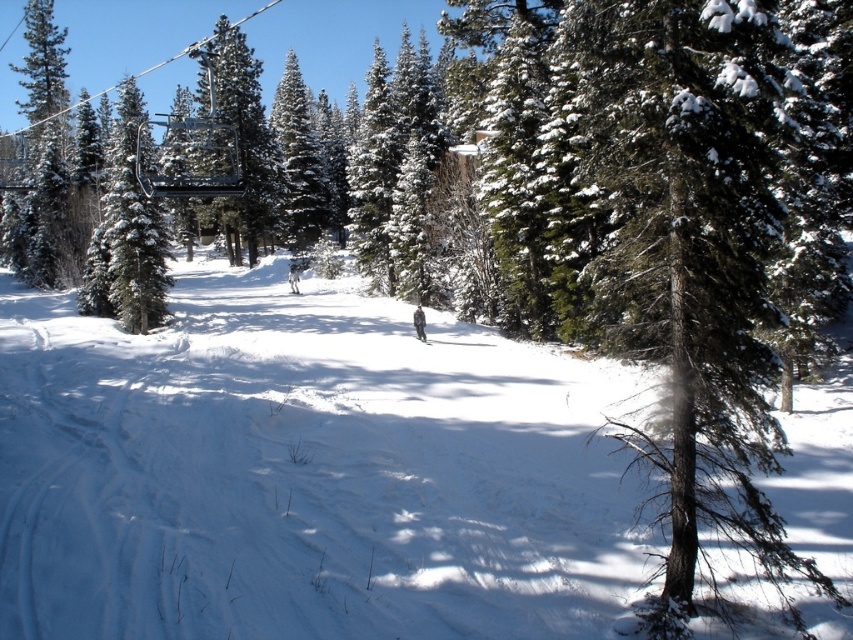
Question: Which object is the closest to the green matte evergreen tree at center?

Choices:
 (A) white plastic ski at center
 (B) white matte ski at center
 (C) white snow at center

Answer: (B)

Question: Can you confirm if white snow at center is wider than white matte ski at center?

Choices:
 (A) yes
 (B) no

Answer: (A)

Question: Which object is the closest to the white plastic ski at center?

Choices:
 (A) white matte ski at center
 (B) white snow at center

Answer: (B)

Question: Is white snow at center further to camera compared to green matte evergreen tree at center?

Choices:
 (A) yes
 (B) no

Answer: (B)

Question: Is white snow at center smaller than green matte evergreen tree at center?

Choices:
 (A) yes
 (B) no

Answer: (A)

Question: Which point is closer to the camera taking this photo?

Choices:
 (A) (430, 344)
 (B) (312, 154)
 (C) (413, 544)
 (D) (292, 291)

Answer: (C)